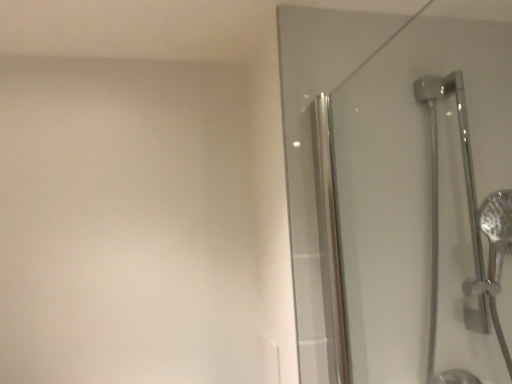
At what (x,y) coordinates should I click in order to perform the action: click on clear glass shower door at right. Please return your answer as a coordinate pair (x, y). This screenshot has width=512, height=384. Looking at the image, I should click on (426, 206).

This screenshot has height=384, width=512. What do you see at coordinates (426, 206) in the screenshot? I see `clear glass shower door at right` at bounding box center [426, 206].

Image resolution: width=512 pixels, height=384 pixels. Identify the location of clear glass shower door at right. (426, 206).